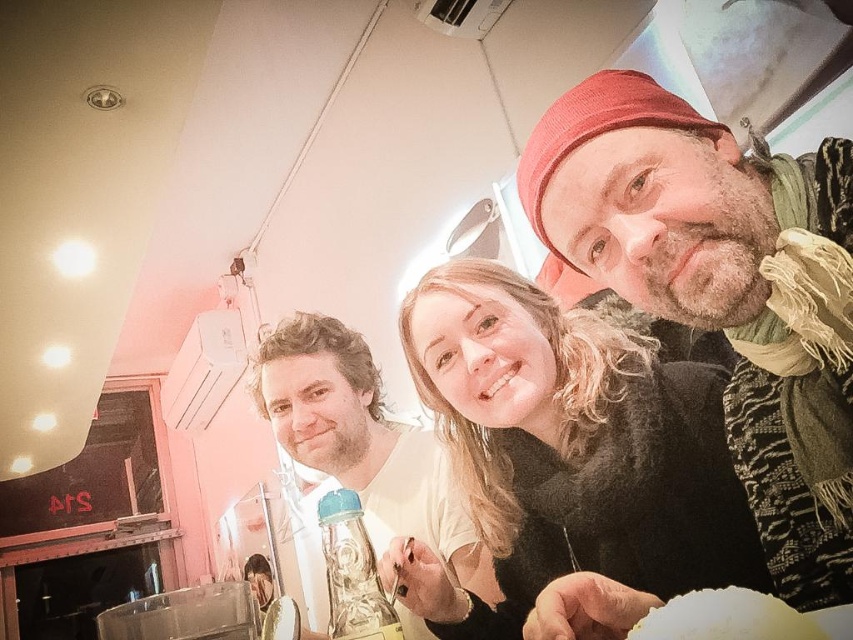
From the picture: Between knitted wool hat at upper right and white matte plate at lower right, which one appears on the right side from the viewer's perspective?

From the viewer's perspective, knitted wool hat at upper right appears more on the right side.

What do you see at coordinates (712, 288) in the screenshot? Image resolution: width=853 pixels, height=640 pixels. I see `knitted wool hat at upper right` at bounding box center [712, 288].

Is point (616, 112) closer to viewer compared to point (758, 600)?

No, (616, 112) is behind (758, 600).

Locate an element on the screen. knitted wool hat at upper right is located at coordinates (712, 288).

Is blonde hair at center closer to camera compared to matte white shirt at center?

Yes, it is.

Which is behind, point (601, 472) or point (374, 508)?

The point (374, 508) is more distant.

Which is behind, point (525, 509) or point (412, 452)?

Point (412, 452)

I want to click on blonde hair at center, so click(x=567, y=451).

Who is more distant from viewer, (614, 131) or (289, 368)?

The point (289, 368) is more distant.

Between knitted wool hat at upper right and matte white shirt at center, which one has more height?

Standing taller between the two is matte white shirt at center.

Find the location of a particular element. knitted wool hat at upper right is located at coordinates (x=712, y=288).

At what (x,y) coordinates should I click in order to perform the action: click on knitted wool hat at upper right. Please return your answer as a coordinate pair (x, y). The width and height of the screenshot is (853, 640). Looking at the image, I should click on (712, 288).